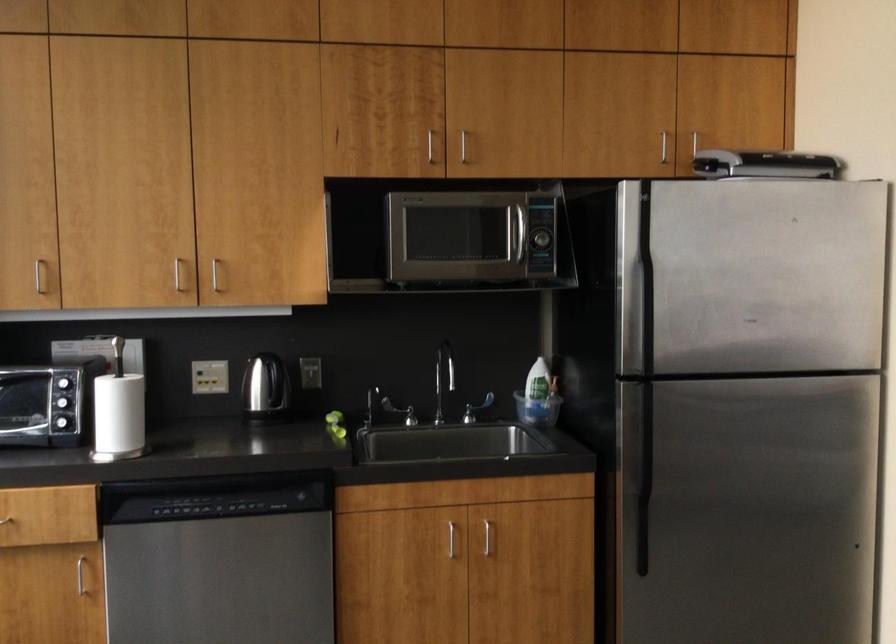
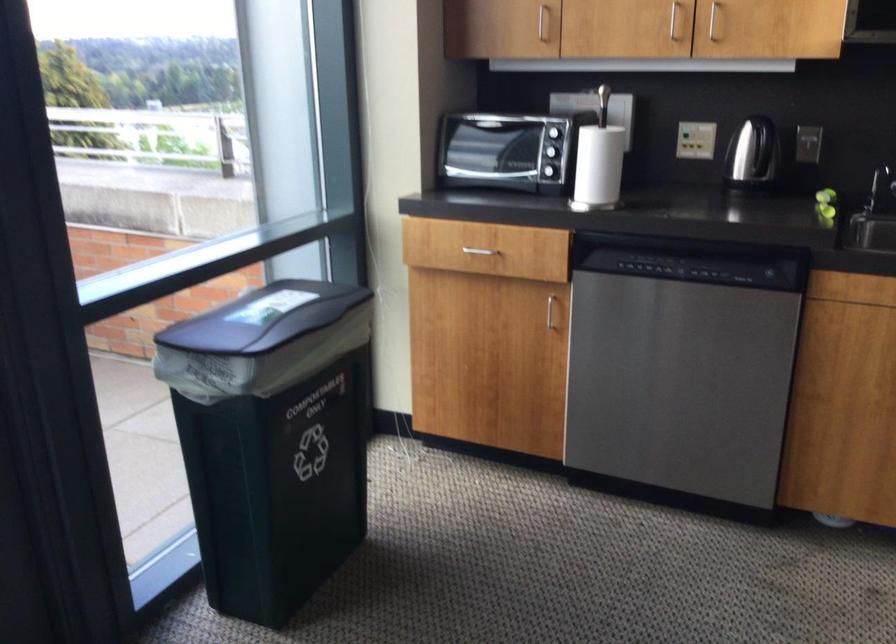
Find the pixel in the second image that matches point 270,391 in the first image.

(752, 152)